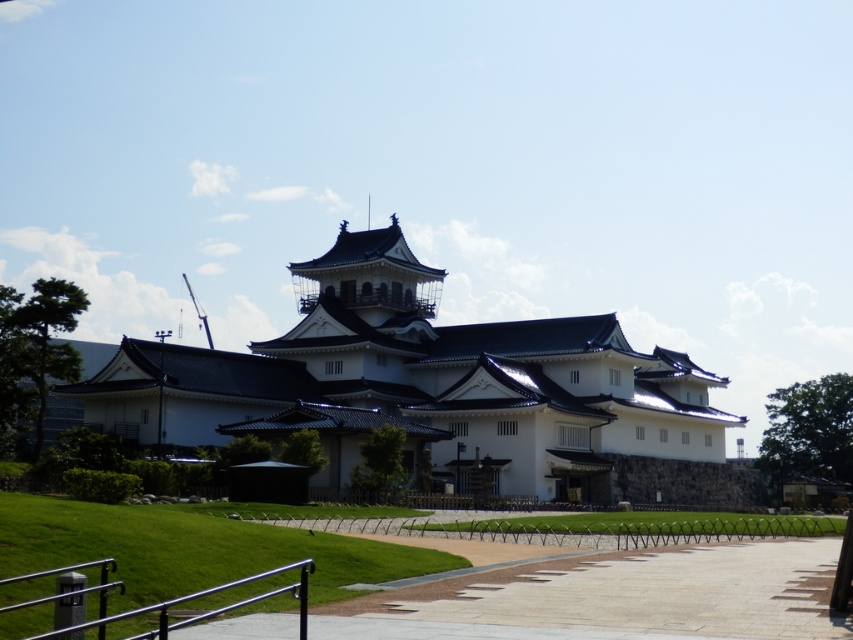
You are standing at the entrance of the traditional Japanese building and want to take a photo of the point marked at coordinates point (432, 433). Can you capture the entire point in your photo without moving from your current position?

The point marked at coordinates point (432, 433) is 326.47 feet away from you. Since this distance is quite far, it might be challenging to capture the entire point in your photo without moving closer or using a zoom lens.

You are standing at the entrance of the white matte building at center. You want to walk straight ahead towards the direction you are facing. What will you encounter first? The lawn or the stone wall?

The white matte building at center is positioned at point (421, 381), so walking straight ahead from the entrance would first encounter the lawn before reaching the stone wall.